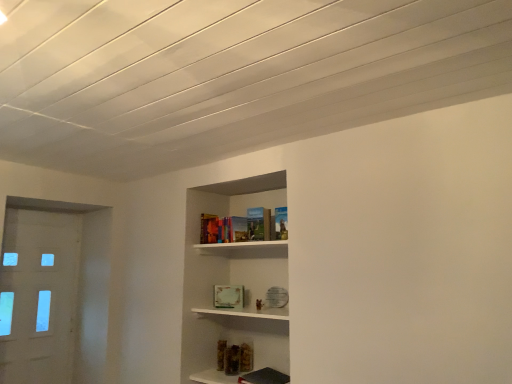
This screenshot has height=384, width=512. Identify the location of vacant space in matte hardcover book at center (from a real-world perspective). (221, 243).